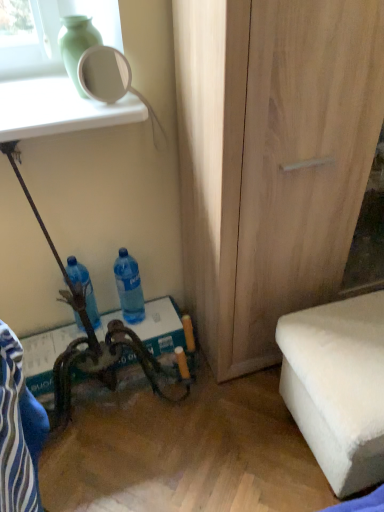
The image size is (384, 512). What do you see at coordinates (18, 431) in the screenshot?
I see `blue fabric swivel chair at lower left` at bounding box center [18, 431].

Measure the distance between point (115, 72) and camera.

Point (115, 72) is 9.03 feet from camera.

I want to click on green matte vase at upper left, so click(76, 44).

The width and height of the screenshot is (384, 512). What do you see at coordinates (85, 287) in the screenshot? I see `blue plastic bottle at lower left, which appears as the first bottle when viewed from the left` at bounding box center [85, 287].

I want to click on blue translucent bottle at lower center, placed as the 2th bottle when sorted from left to right, so click(x=129, y=287).

In the scene shown: From the image's perspective, which object appears higher, white fluffy ottoman at lower right or white glossy mirror at upper left?

white glossy mirror at upper left appears higher in the image.

Based on the photo, considering the sizes of objects white fluffy ottoman at lower right and white glossy mirror at upper left in the image provided, who is shorter, white fluffy ottoman at lower right or white glossy mirror at upper left?

white glossy mirror at upper left.

Is white fluffy ottoman at lower right positioned behind white glossy mirror at upper left?

No, white fluffy ottoman at lower right is closer to the viewer.

From the picture: Is white fluffy ottoman at lower right thinner than white glossy mirror at upper left?

No.

Is blue plastic bottle at lower left, which ranks as the 2th bottle in right-to-left order, positioned with its back to white fluffy ottoman at lower right?

No, blue plastic bottle at lower left, which ranks as the 2th bottle in right-to-left order, is not facing the opposite direction of white fluffy ottoman at lower right.

Is blue plastic bottle at lower left, which appears as the first bottle when viewed from the left, far away from white fluffy ottoman at lower right?

They are positioned close to each other.

Considering the sizes of objects blue plastic bottle at lower left, which ranks as the 2th bottle in right-to-left order, and white fluffy ottoman at lower right in the image provided, who is wider, blue plastic bottle at lower left, which ranks as the 2th bottle in right-to-left order, or white fluffy ottoman at lower right?

Wider between the two is white fluffy ottoman at lower right.

Is blue plastic bottle at lower left, which appears as the first bottle when viewed from the left, not within white fluffy ottoman at lower right?

That's correct, blue plastic bottle at lower left, which appears as the first bottle when viewed from the left, is outside of white fluffy ottoman at lower right.

Which object is closer to the camera taking this photo, light wood cabinet at center or white fluffy ottoman at lower right?

light wood cabinet at center is more forward.

How much distance is there between light wood cabinet at center and white fluffy ottoman at lower right?

They are 15.84 inches apart.

Do you think light wood cabinet at center is within white fluffy ottoman at lower right, or outside of it?

The correct answer is: outside.

Are light wood cabinet at center and white fluffy ottoman at lower right far apart?

No, light wood cabinet at center is in close proximity to white fluffy ottoman at lower right.

Considering the positions of objects white glossy mirror at upper left and green matte vase at upper left in the image provided, who is behind, white glossy mirror at upper left or green matte vase at upper left?

white glossy mirror at upper left is behind.

From the image's perspective, relative to green matte vase at upper left, is white glossy mirror at upper left above or below?

Based on their image positions, white glossy mirror at upper left is located beneath green matte vase at upper left.

Between white glossy mirror at upper left and green matte vase at upper left, which one has smaller width?

white glossy mirror at upper left.

Considering the relative sizes of blue translucent bottle at lower center, which is the 1th bottle from right to left, and white glossy mirror at upper left in the image provided, is blue translucent bottle at lower center, which is the 1th bottle from right to left, bigger than white glossy mirror at upper left?

Yes, blue translucent bottle at lower center, which is the 1th bottle from right to left, is bigger than white glossy mirror at upper left.

Identify the location of mirror in front of the blue translucent bottle at lower center, which is the 1th bottle from right to left. The height and width of the screenshot is (512, 384). (104, 74).

In terms of width, does blue translucent bottle at lower center, placed as the 2th bottle when sorted from left to right, look wider or thinner when compared to white glossy mirror at upper left?

blue translucent bottle at lower center, placed as the 2th bottle when sorted from left to right, is wider than white glossy mirror at upper left.

Looking at this image, is blue translucent bottle at lower center, which is the 1th bottle from right to left, positioned beyond the bounds of white glossy mirror at upper left?

Yes, blue translucent bottle at lower center, which is the 1th bottle from right to left, is located beyond the bounds of white glossy mirror at upper left.

From a real-world perspective, between white fluffy ottoman at lower right and blue fabric swivel chair at lower left, who is vertically higher?

blue fabric swivel chair at lower left is physically above.

Are white fluffy ottoman at lower right and blue fabric swivel chair at lower left located far from each other?

They are positioned close to each other.

Which object is further away from the camera taking this photo, white fluffy ottoman at lower right or blue fabric swivel chair at lower left?

white fluffy ottoman at lower right is further away from the camera.

In the scene shown: Which is nearer, (92, 306) or (90, 60)?

The point (92, 306) is in front.

Is blue plastic bottle at lower left, which ranks as the 2th bottle in right-to-left order, inside the boundaries of white glossy mirror at upper left, or outside?

blue plastic bottle at lower left, which ranks as the 2th bottle in right-to-left order, exists outside the volume of white glossy mirror at upper left.

You are a GUI agent. You are given a task and a screenshot of the screen. Output one action in this format:
    pyautogui.click(x=<x>, y=<y>)
    Task: Click on the bottle to the left of white glossy mirror at upper left
    This screenshot has width=384, height=512.
    Given the screenshot: What is the action you would take?
    pyautogui.click(x=85, y=287)

Considering the relative sizes of blue plastic bottle at lower left, which appears as the first bottle when viewed from the left, and white glossy mirror at upper left in the image provided, is blue plastic bottle at lower left, which appears as the first bottle when viewed from the left, wider than white glossy mirror at upper left?

Yes, blue plastic bottle at lower left, which appears as the first bottle when viewed from the left, is wider than white glossy mirror at upper left.

Identify the location of mirror above the white fluffy ottoman at lower right (from a real-world perspective). This screenshot has width=384, height=512. (104, 74).

You are a GUI agent. You are given a task and a screenshot of the screen. Output one action in this format:
    pyautogui.click(x=<x>, y=<y>)
    Task: Click on the furniture lying below the blue plastic bottle at lower left, which appears as the first bottle when viewed from the left (from the image's perspective)
    
    Given the screenshot: What is the action you would take?
    pyautogui.click(x=338, y=387)

Based on their spatial positions, is green matte vase at upper left or white fluffy ottoman at lower right closer to light wood cabinet at center?

The object closer to light wood cabinet at center is white fluffy ottoman at lower right.

Based on their spatial positions, is blue fabric swivel chair at lower left or blue translucent bottle at lower center, placed as the 2th bottle when sorted from left to right, closer to white fluffy ottoman at lower right?

blue fabric swivel chair at lower left.

Estimate the real-world distances between objects in this image. Which object is closer to blue translucent bottle at lower center, placed as the 2th bottle when sorted from left to right, green matte vase at upper left or light wood cabinet at center?

light wood cabinet at center is closer to blue translucent bottle at lower center, placed as the 2th bottle when sorted from left to right.

Considering their positions, is blue plastic bottle at lower left, which ranks as the 2th bottle in right-to-left order, positioned further to green matte vase at upper left than blue fabric swivel chair at lower left?

Among the two, blue fabric swivel chair at lower left is located further to green matte vase at upper left.

Based on their spatial positions, is white glossy mirror at upper left or blue translucent bottle at lower center, which is the 1th bottle from right to left, closer to blue fabric swivel chair at lower left?

Based on the image, blue translucent bottle at lower center, which is the 1th bottle from right to left, appears to be nearer to blue fabric swivel chair at lower left.

Based on their spatial positions, is blue fabric swivel chair at lower left or green matte vase at upper left closer to white glossy mirror at upper left?

Based on the image, green matte vase at upper left appears to be nearer to white glossy mirror at upper left.

From the image, which object appears to be farther from blue plastic bottle at lower left, which appears as the first bottle when viewed from the left, blue translucent bottle at lower center, placed as the 2th bottle when sorted from left to right, or blue fabric swivel chair at lower left?

blue fabric swivel chair at lower left is further to blue plastic bottle at lower left, which appears as the first bottle when viewed from the left.

Looking at the image, which one is located closer to blue fabric swivel chair at lower left, white fluffy ottoman at lower right or light wood cabinet at center?

Based on the image, white fluffy ottoman at lower right appears to be nearer to blue fabric swivel chair at lower left.

This screenshot has width=384, height=512. In order to click on mirror situated between blue plastic bottle at lower left, which ranks as the 2th bottle in right-to-left order, and light wood cabinet at center from left to right in this screenshot , I will do `click(104, 74)`.

Find the location of a particular element. cabinetry between green matte vase at upper left and white fluffy ottoman at lower right in the up-down direction is located at coordinates (271, 160).

Identify the location of bottle between green matte vase at upper left and blue plastic bottle at lower left, which appears as the first bottle when viewed from the left, vertically. The height and width of the screenshot is (512, 384). (129, 287).

This screenshot has height=512, width=384. In order to click on bottle situated between blue plastic bottle at lower left, which appears as the first bottle when viewed from the left, and light wood cabinet at center from left to right in this screenshot , I will do `click(129, 287)`.